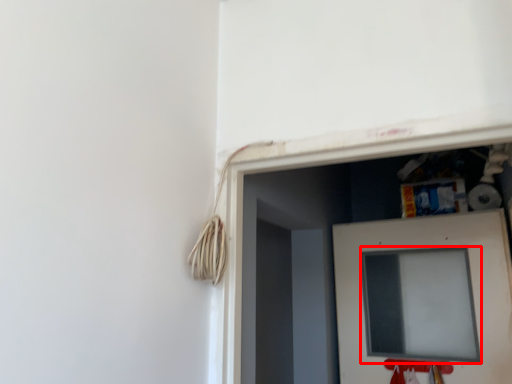
Question: Considering the relative positions of computer screen (annotated by the red box) and door in the image provided, where is computer screen (annotated by the red box) located with respect to the staircase?

Choices:
 (A) left
 (B) right

Answer: (A)